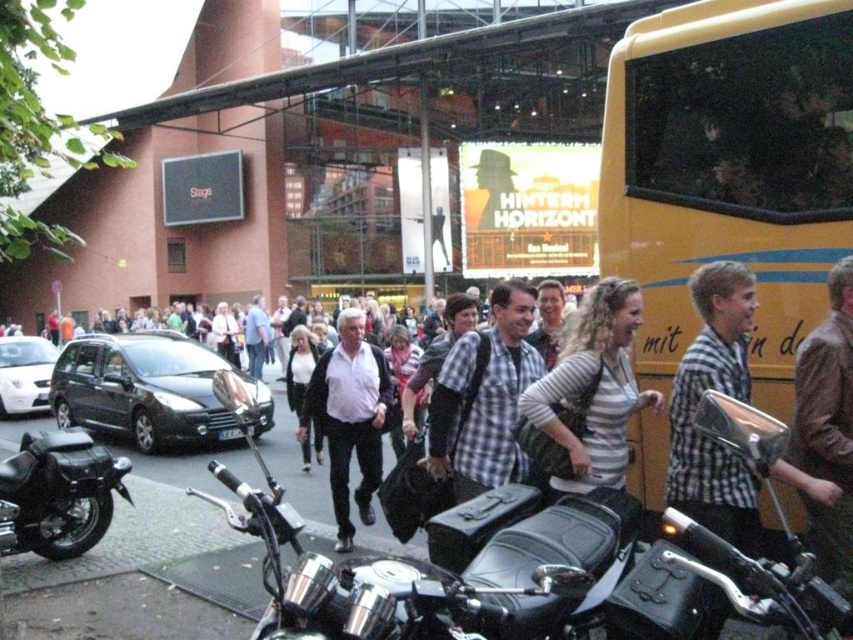
You are a delivery person who needs to park your shiny chrome motorcycle at center as close as possible to the entrance of the theater. The entrance is located behind the billboard. Can you estimate whether the motorcycle will be within 7 feet of the entrance if parked at its current position?

The distance of shiny chrome motorcycle at center from camera is 6.90 feet, so yes, the motorcycle will be within 7 feet of the entrance if parked at its current position.

You are a delivery person who needs to pass by the shiny chrome motorcycle at center and the striped cotton shirt at center. Which object is wider and requires more space to navigate around?

The shiny chrome motorcycle at center is wider than the striped cotton shirt at center, so it requires more space to navigate around.

You are a delivery person with a package that needs to be placed between the black leather motorcycle at lower left and the white matte shirt at center. The package requires a minimum of 2 meters of space to be safely placed. Can you fit the package there?

The distance between the black leather motorcycle at lower left and the white matte shirt at center is 1.83 meters, which is less than the required 2 meters. Therefore, the package cannot be safely placed there.